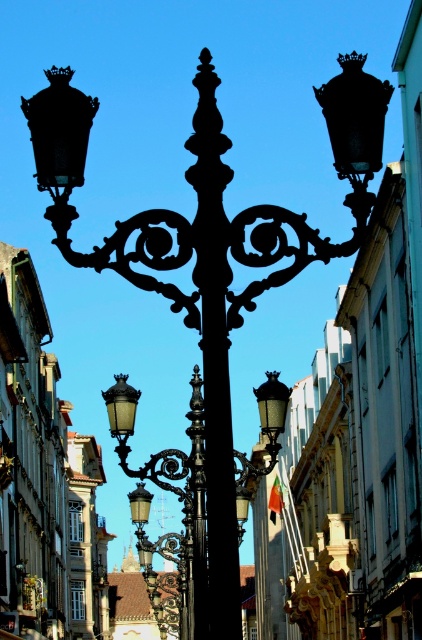
Who is more forward, [210,56] or [173,492]?

Point [210,56] is more forward.

Who is taller, black wrought iron pole at center or matte black street light at center?

Standing taller between the two is matte black street light at center.

Which is behind, point (222, 497) or point (129, 451)?

The point (129, 451) is behind.

Locate an element on the screen. black wrought iron pole at center is located at coordinates (214, 349).